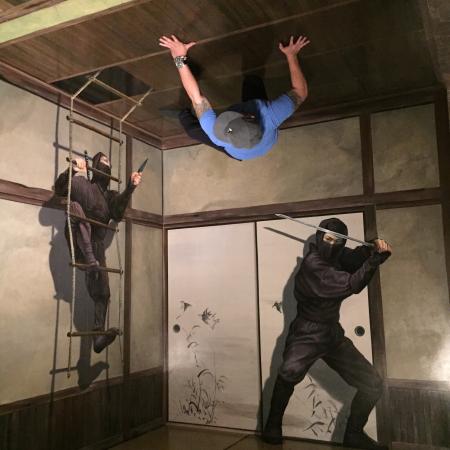
Where is `wooden ceiling`? The height and width of the screenshot is (450, 450). wooden ceiling is located at coordinates (340, 49).